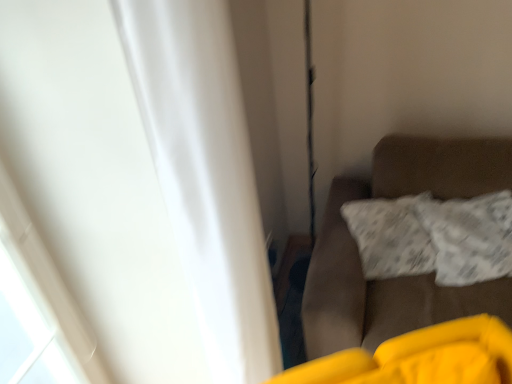
Locate an element on the screen. The image size is (512, 384). white textured pillow at right is located at coordinates (469, 237).

Can brown fabric couch at right be found inside white matte curtain at left?

No, brown fabric couch at right is not surrounded by white matte curtain at left.

Which object is wider, white matte curtain at left or brown fabric couch at right?

brown fabric couch at right.

Based on their sizes in the image, would you say white matte curtain at left is bigger or smaller than brown fabric couch at right?

In the image, white matte curtain at left appears to be smaller than brown fabric couch at right.

This screenshot has width=512, height=384. I want to click on furniture behind the white matte curtain at left, so click(400, 277).

Is brown fabric couch at right oriented away from white textured pillow at right?

That's right, brown fabric couch at right is facing away from white textured pillow at right.

Is brown fabric couch at right at the left side of white textured pillow at right?

Indeed, brown fabric couch at right is positioned on the left side of white textured pillow at right.

The width and height of the screenshot is (512, 384). What are the coordinates of `pillow on the right of brown fabric couch at right` in the screenshot? It's located at (469, 237).

Considering the relative sizes of brown fabric couch at right and white matte curtain at left in the image provided, is brown fabric couch at right smaller than white matte curtain at left?

Incorrect, brown fabric couch at right is not smaller in size than white matte curtain at left.

Is brown fabric couch at right in contact with white matte curtain at left?

No, brown fabric couch at right is not with white matte curtain at left.

Is brown fabric couch at right facing towards white matte curtain at left?

No, brown fabric couch at right is not turned towards white matte curtain at left.

From a real-world perspective, is brown fabric couch at right below white matte curtain at left?

Yes, from a real-world perspective, brown fabric couch at right is below white matte curtain at left.

Is white matte curtain at left at the back of white textured pillow at right?

No, white textured pillow at right is not facing the opposite direction of white matte curtain at left.

There is a white textured pillow at right. Identify the location of curtain above it (from a real-world perspective). Image resolution: width=512 pixels, height=384 pixels. (141, 185).

Based on the photo, which of these two, white textured pillow at right or white matte curtain at left, is bigger?

With larger size is white matte curtain at left.

How different are the orientations of white textured pillow at right and white matte curtain at left in degrees?

The facing directions of white textured pillow at right and white matte curtain at left are 69.4 degrees apart.

How far apart are white textured pillow at right and brown fabric couch at right?

white textured pillow at right is 6.53 inches away from brown fabric couch at right.

Is white textured pillow at right smaller than brown fabric couch at right?

Indeed, white textured pillow at right has a smaller size compared to brown fabric couch at right.

From the picture: Is white textured pillow at right completely or partially outside of brown fabric couch at right?

No.

From their relative heights in the image, would you say white textured pillow at right is taller or shorter than brown fabric couch at right?

Considering their sizes, white textured pillow at right has less height than brown fabric couch at right.

Is white matte curtain at left smaller than white textured pillow at right?

No, white matte curtain at left is not smaller than white textured pillow at right.

From the image's perspective, is white matte curtain at left located above white textured pillow at right?

No, from the image's perspective, white matte curtain at left is not above white textured pillow at right.

Do you think white matte curtain at left is within white textured pillow at right, or outside of it?

white matte curtain at left is outside white textured pillow at right.

Which is more to the right, white matte curtain at left or white textured pillow at right?

Positioned to the right is white textured pillow at right.

This screenshot has width=512, height=384. Identify the location of curtain on the left of brown fabric couch at right. (141, 185).

Find the location of a particular element. pillow above the brown fabric couch at right (from the image's perspective) is located at coordinates (469, 237).

Which object lies nearer to the anchor point white textured pillow at right, white matte curtain at left or brown fabric couch at right?

Among the two, brown fabric couch at right is located nearer to white textured pillow at right.

Estimate the real-world distances between objects in this image. Which object is closer to white matte curtain at left, white textured pillow at right or brown fabric couch at right?

Among the two, brown fabric couch at right is located nearer to white matte curtain at left.

From the image, which object appears to be farther from white textured pillow at right, brown fabric couch at right or white matte curtain at left?

white matte curtain at left is positioned further to the anchor white textured pillow at right.

Looking at the image, which one is located further to white matte curtain at left, brown fabric couch at right or white textured pillow at right?

white textured pillow at right is further to white matte curtain at left.

From the image, which object appears to be nearer to brown fabric couch at right, white matte curtain at left or white textured pillow at right?

The object closer to brown fabric couch at right is white textured pillow at right.

Considering their positions, is white textured pillow at right positioned further to brown fabric couch at right than white matte curtain at left?

white matte curtain at left.

Find the location of a particular element. furniture between white matte curtain at left and white textured pillow at right in the horizontal direction is located at coordinates (400, 277).